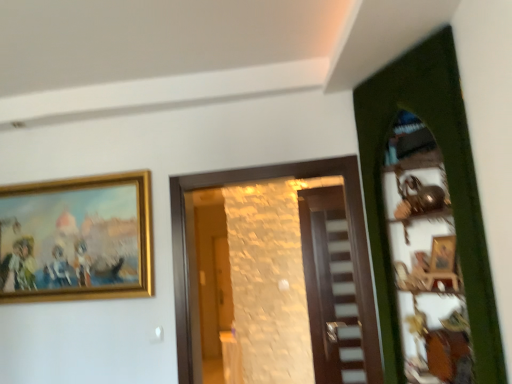
In order to click on gold/gilded picture frame at upper left in this screenshot , I will do `click(76, 239)`.

Identify the location of green wooden door at right, the third door in the back-to-front sequence. (448, 185).

From a real-world perspective, is green wooden door at right, the third door in the back-to-front sequence, positioned over matte wooden door at center, marked as the third door in a front-to-back arrangement, based on gravity?

Yes, from a real-world perspective, green wooden door at right, the third door in the back-to-front sequence, is above matte wooden door at center, marked as the third door in a front-to-back arrangement.

Consider the image. Is green wooden door at right, the 1th door from the front, bigger than matte wooden door at center, marked as the third door in a front-to-back arrangement?

Yes, green wooden door at right, the 1th door from the front, is bigger than matte wooden door at center, marked as the third door in a front-to-back arrangement.

Is matte wooden door at center, which is the 1th door from back to front, a part of green wooden door at right, the third door in the back-to-front sequence?

No, matte wooden door at center, which is the 1th door from back to front, is not a part of green wooden door at right, the third door in the back-to-front sequence.

Which is more to the left, green wooden door at right, the third door in the back-to-front sequence, or matte wooden door at center, marked as the third door in a front-to-back arrangement?

matte wooden door at center, marked as the third door in a front-to-back arrangement, is more to the left.

Can you tell me how much matte wooden door at center, marked as the third door in a front-to-back arrangement, and gold/gilded picture frame at upper left differ in facing direction?

0.136 degrees separate the facing orientations of matte wooden door at center, marked as the third door in a front-to-back arrangement, and gold/gilded picture frame at upper left.

Is matte wooden door at center, which is the 1th door from back to front, at the left side of gold/gilded picture frame at upper left?

No, matte wooden door at center, which is the 1th door from back to front, is not to the left of gold/gilded picture frame at upper left.

Is matte wooden door at center, which is the 1th door from back to front, in contact with gold/gilded picture frame at upper left?

matte wooden door at center, which is the 1th door from back to front, and gold/gilded picture frame at upper left are clearly separated.

From the image's perspective, is matte wooden door at center, marked as the third door in a front-to-back arrangement, above or below gold/gilded picture frame at upper left?

Clearly, from the image's perspective, matte wooden door at center, marked as the third door in a front-to-back arrangement, is below gold/gilded picture frame at upper left.

Considering the relative positions of gold/gilded picture frame at upper left and matte wooden door at center, marked as the third door in a front-to-back arrangement, in the image provided, is gold/gilded picture frame at upper left in front of matte wooden door at center, marked as the third door in a front-to-back arrangement,?

Yes, gold/gilded picture frame at upper left is closer to the viewer.

Which of these two, gold/gilded picture frame at upper left or matte wooden door at center, which is the 1th door from back to front, is smaller?

Smaller between the two is matte wooden door at center, which is the 1th door from back to front.

Does gold/gilded picture frame at upper left touch matte wooden door at center, marked as the third door in a front-to-back arrangement?

gold/gilded picture frame at upper left and matte wooden door at center, marked as the third door in a front-to-back arrangement, are clearly separated.

Considering the sizes of objects gold/gilded picture frame at upper left and wooden door at center, which ranks as the 2th door in back-to-front order, in the image provided, who is taller, gold/gilded picture frame at upper left or wooden door at center, which ranks as the 2th door in back-to-front order,?

Standing taller between the two is wooden door at center, which ranks as the 2th door in back-to-front order.

Is gold/gilded picture frame at upper left to the left of wooden door at center, which ranks as the 2th door in back-to-front order, from the viewer's perspective?

Correct, you'll find gold/gilded picture frame at upper left to the left of wooden door at center, which ranks as the 2th door in back-to-front order.

Can you confirm if gold/gilded picture frame at upper left is thinner than wooden door at center, which ranks as the 2th door in back-to-front order?

Yes, gold/gilded picture frame at upper left is thinner than wooden door at center, which ranks as the 2th door in back-to-front order.

Is gold/gilded picture frame at upper left in contact with wooden door at center, which ranks as the 2th door in back-to-front order?

No.

How different are the orientations of matte wooden door at center, which is the 1th door from back to front, and green wooden door at right, the third door in the back-to-front sequence, in degrees?

The angle between the facing direction of matte wooden door at center, which is the 1th door from back to front, and the facing direction of green wooden door at right, the third door in the back-to-front sequence, is 58.1 degrees.

Consider the image. How much distance is there between matte wooden door at center, marked as the third door in a front-to-back arrangement, and green wooden door at right, the 1th door from the front?

matte wooden door at center, marked as the third door in a front-to-back arrangement, and green wooden door at right, the 1th door from the front, are 4.83 feet apart from each other.

Consider the image. Which of these two, matte wooden door at center, marked as the third door in a front-to-back arrangement, or green wooden door at right, the third door in the back-to-front sequence, stands shorter?

Standing shorter between the two is green wooden door at right, the third door in the back-to-front sequence.

Is green wooden door at right, the third door in the back-to-front sequence, surrounded by matte wooden door at center, marked as the third door in a front-to-back arrangement?

No, green wooden door at right, the third door in the back-to-front sequence, is not a part of matte wooden door at center, marked as the third door in a front-to-back arrangement.

Is gold/gilded picture frame at upper left oriented away from green wooden door at right, the third door in the back-to-front sequence?

No, green wooden door at right, the third door in the back-to-front sequence, is not at the back of gold/gilded picture frame at upper left.

Which object is closer to the camera taking this photo, gold/gilded picture frame at upper left or green wooden door at right, the third door in the back-to-front sequence?

green wooden door at right, the third door in the back-to-front sequence, is in front.

Is gold/gilded picture frame at upper left positioned beyond the bounds of green wooden door at right, the third door in the back-to-front sequence?

Absolutely, gold/gilded picture frame at upper left is external to green wooden door at right, the third door in the back-to-front sequence.

Which is more to the left, gold/gilded picture frame at upper left or green wooden door at right, the third door in the back-to-front sequence?

gold/gilded picture frame at upper left is more to the left.

Considering the positions of objects wooden door at center, which ranks as the second door in front-to-back order, and gold/gilded picture frame at upper left in the image provided, who is more to the right, wooden door at center, which ranks as the second door in front-to-back order, or gold/gilded picture frame at upper left?

From the viewer's perspective, wooden door at center, which ranks as the second door in front-to-back order, appears more on the right side.

Is wooden door at center, which ranks as the 2th door in back-to-front order, behind gold/gilded picture frame at upper left?

That is False.

Does wooden door at center, which ranks as the 2th door in back-to-front order, have a smaller size compared to gold/gilded picture frame at upper left?

No, wooden door at center, which ranks as the 2th door in back-to-front order, is not smaller than gold/gilded picture frame at upper left.

Identify the location of door that is the 2nd one when counting forward from the matte wooden door at center, marked as the third door in a front-to-back arrangement. (448, 185).

In order to click on picture frame that appears on the left of matte wooden door at center, marked as the third door in a front-to-back arrangement in this screenshot , I will do `click(76, 239)`.

When comparing their distances from green wooden door at right, the 1th door from the front, does wooden door at center, which ranks as the 2th door in back-to-front order, or matte wooden door at center, which is the 1th door from back to front, seem closer?

wooden door at center, which ranks as the 2th door in back-to-front order, is closer to green wooden door at right, the 1th door from the front.

Estimate the real-world distances between objects in this image. Which object is closer to gold/gilded picture frame at upper left, matte wooden door at center, which is the 1th door from back to front, or green wooden door at right, the third door in the back-to-front sequence?

Among the two, green wooden door at right, the third door in the back-to-front sequence, is located nearer to gold/gilded picture frame at upper left.

From the image, which object appears to be nearer to wooden door at center, which ranks as the second door in front-to-back order, gold/gilded picture frame at upper left or green wooden door at right, the 1th door from the front?

Among the two, green wooden door at right, the 1th door from the front, is located nearer to wooden door at center, which ranks as the second door in front-to-back order.

Considering their positions, is green wooden door at right, the third door in the back-to-front sequence, positioned further to wooden door at center, which ranks as the second door in front-to-back order, than gold/gilded picture frame at upper left?

Based on the image, gold/gilded picture frame at upper left appears to be further to wooden door at center, which ranks as the second door in front-to-back order.

When comparing their distances from gold/gilded picture frame at upper left, does wooden door at center, which ranks as the second door in front-to-back order, or green wooden door at right, the 1th door from the front, seem closer?

Based on the image, wooden door at center, which ranks as the second door in front-to-back order, appears to be nearer to gold/gilded picture frame at upper left.

From the image, which object appears to be nearer to matte wooden door at center, marked as the third door in a front-to-back arrangement, wooden door at center, which ranks as the 2th door in back-to-front order, or gold/gilded picture frame at upper left?

Based on the image, wooden door at center, which ranks as the 2th door in back-to-front order, appears to be nearer to matte wooden door at center, marked as the third door in a front-to-back arrangement.

Looking at the image, which one is located further to green wooden door at right, the third door in the back-to-front sequence, matte wooden door at center, marked as the third door in a front-to-back arrangement, or gold/gilded picture frame at upper left?

The object further to green wooden door at right, the third door in the back-to-front sequence, is gold/gilded picture frame at upper left.

Based on their spatial positions, is matte wooden door at center, which is the 1th door from back to front, or wooden door at center, which ranks as the second door in front-to-back order, further from gold/gilded picture frame at upper left?

Among the two, matte wooden door at center, which is the 1th door from back to front, is located further to gold/gilded picture frame at upper left.

The width and height of the screenshot is (512, 384). I want to click on door positioned between green wooden door at right, the third door in the back-to-front sequence, and matte wooden door at center, which is the 1th door from back to front, from near to far, so click(x=264, y=179).

This screenshot has height=384, width=512. Find the location of `door situated between gold/gilded picture frame at upper left and matte wooden door at center, which is the 1th door from back to front, from left to right`. door situated between gold/gilded picture frame at upper left and matte wooden door at center, which is the 1th door from back to front, from left to right is located at coordinates (264, 179).